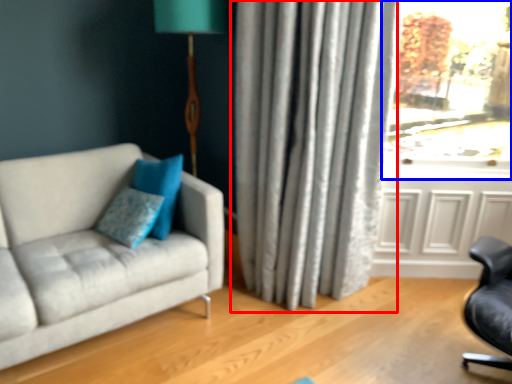
Question: Which object is closer to the camera taking this photo, curtain (highlighted by a red box) or window (highlighted by a blue box)?

Choices:
 (A) curtain
 (B) window

Answer: (A)